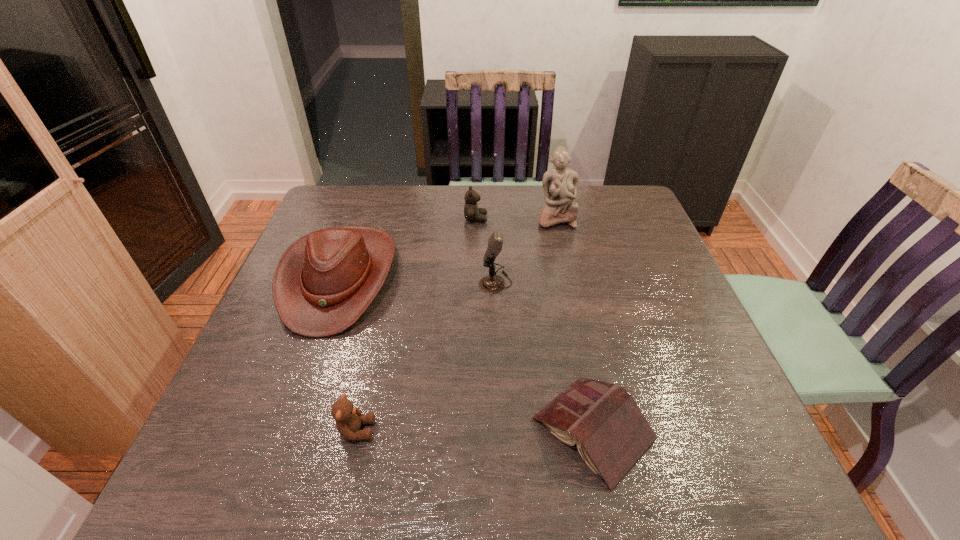
This screenshot has width=960, height=540. What are the coordinates of `vacant space in between the fifth tallest object and the book` in the screenshot? It's located at (475, 430).

Locate an element on the screen. This screenshot has width=960, height=540. vacant space that is in between the fifth shortest object and the figurine is located at coordinates (526, 251).

Identify the location of vacant area between the cowboy hat and the shortest object. The image size is (960, 540). (466, 354).

Where is `free point between the figurine and the book`? This screenshot has height=540, width=960. free point between the figurine and the book is located at coordinates (575, 324).

Image resolution: width=960 pixels, height=540 pixels. What are the coordinates of `free point between the second tallest object and the figurine` in the screenshot? It's located at (526, 251).

Identify which object is located as the second nearest to the microphone. Please provide its 2D coordinates. Your answer should be formatted as a tuple, i.e. [(x, y)], where the tuple contains the x and y coordinates of a point satisfying the conditions above.

[(560, 185)]

You are a GUI agent. You are given a task and a screenshot of the screen. Output one action in this format:
    pyautogui.click(x=<x>, y=<y>)
    Task: Click on the object that is the third closest to the right teddy bear
    
    Given the screenshot: What is the action you would take?
    pyautogui.click(x=491, y=284)

Image resolution: width=960 pixels, height=540 pixels. I want to click on free point that satisfies the following two spatial constraints: 1. on the face of the shortest object; 2. on the right side of the taller teddy bear, so click(x=473, y=429).

Locate an element on the screen. The height and width of the screenshot is (540, 960). free space that satisfies the following two spatial constraints: 1. on the front-facing side of the book; 2. on the right side of the microphone is located at coordinates (501, 429).

The height and width of the screenshot is (540, 960). I want to click on vacant area that satisfies the following two spatial constraints: 1. on the front-facing side of the tallest object; 2. on the front-facing side of the second tallest object, so click(570, 282).